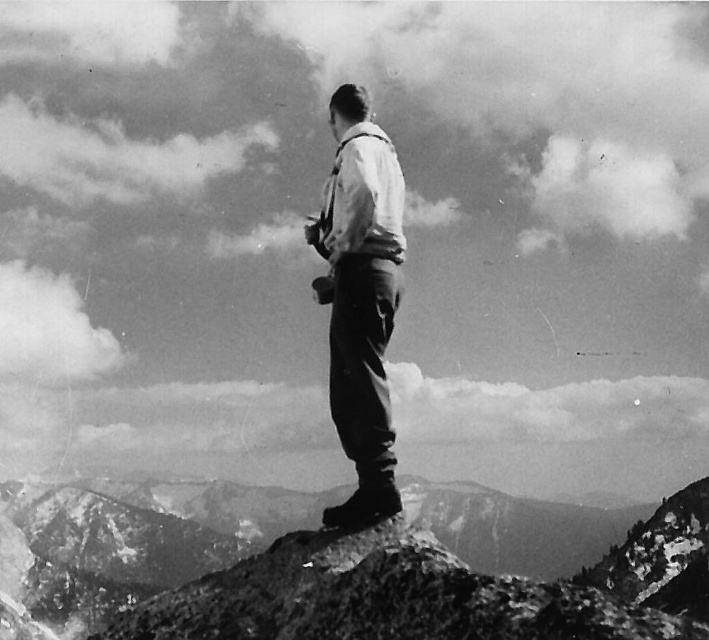
Does rugged stone mountain at center have a greater width compared to matte white shirt at center?

Indeed, rugged stone mountain at center has a greater width compared to matte white shirt at center.

Can you confirm if rugged stone mountain at center is shorter than matte white shirt at center?

No, rugged stone mountain at center is not shorter than matte white shirt at center.

Is point (186, 529) closer to viewer compared to point (389, 196)?

No, (186, 529) is further to viewer.

You are a GUI agent. You are given a task and a screenshot of the screen. Output one action in this format:
    pyautogui.click(x=<x>, y=<y>)
    Task: Click on the rugged stone mountain at center
    
    Given the screenshot: What is the action you would take?
    pyautogui.click(x=325, y=579)